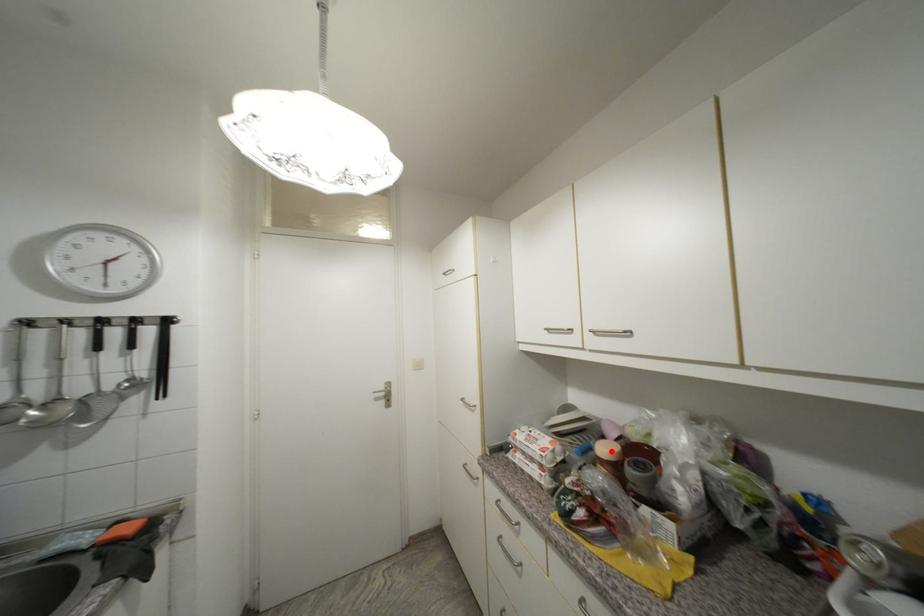
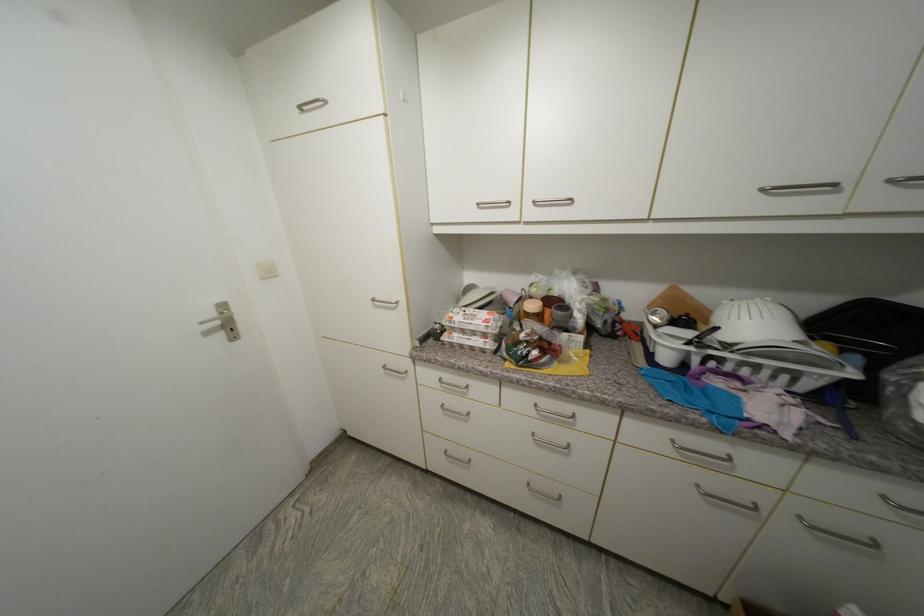
Where in the second image is the point corresponding to the highlighted location from the first image?

(538, 307)